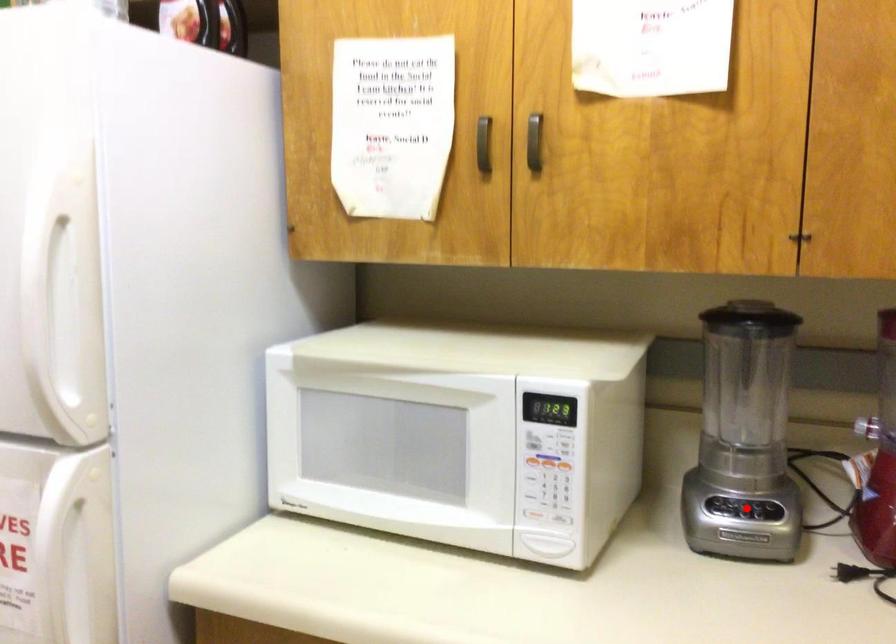
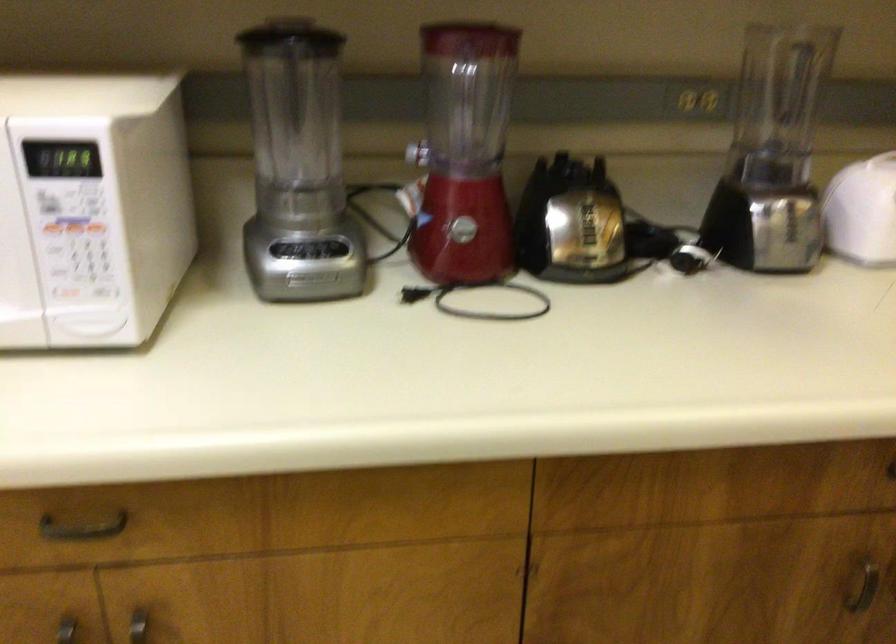
In the second image, find the point that corresponds to the highlighted location in the first image.

(308, 249)